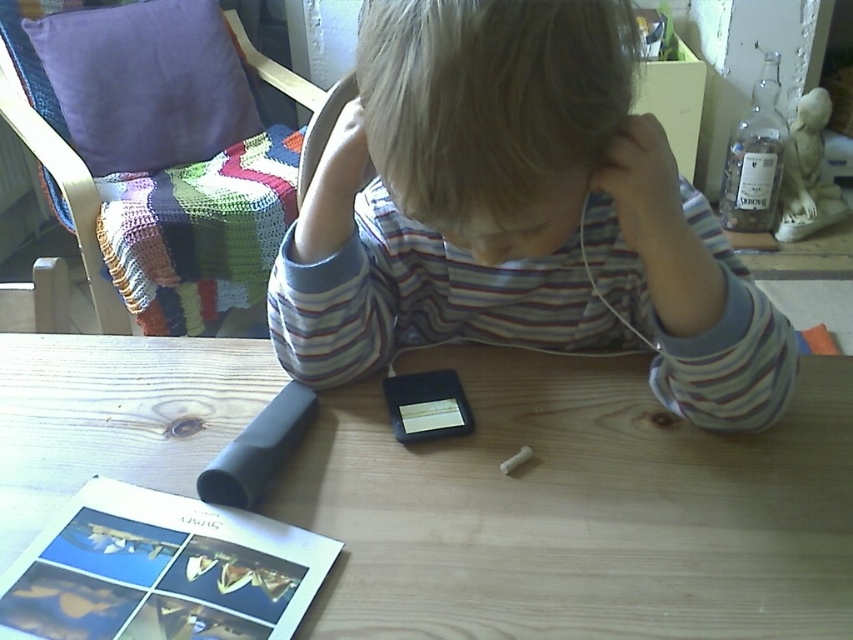
You are a photographer trying to capture a candid shot of the child without them noticing. The wooden table at center and the striped cotton shirt at center are in your viewfinder. Based on their positions, which object is closer to the camera?

The striped cotton shirt at center is closer to the camera because it is positioned above the wooden table at center, meaning the shirt is in front of the table from the photographer s perspective.

You are a photographer taking a picture of the striped cotton shirt at center and the wooden table at center. Which object will appear smaller in the photo?

The striped cotton shirt at center is behind the wooden table at center, so it will appear smaller in the photo due to being farther away.